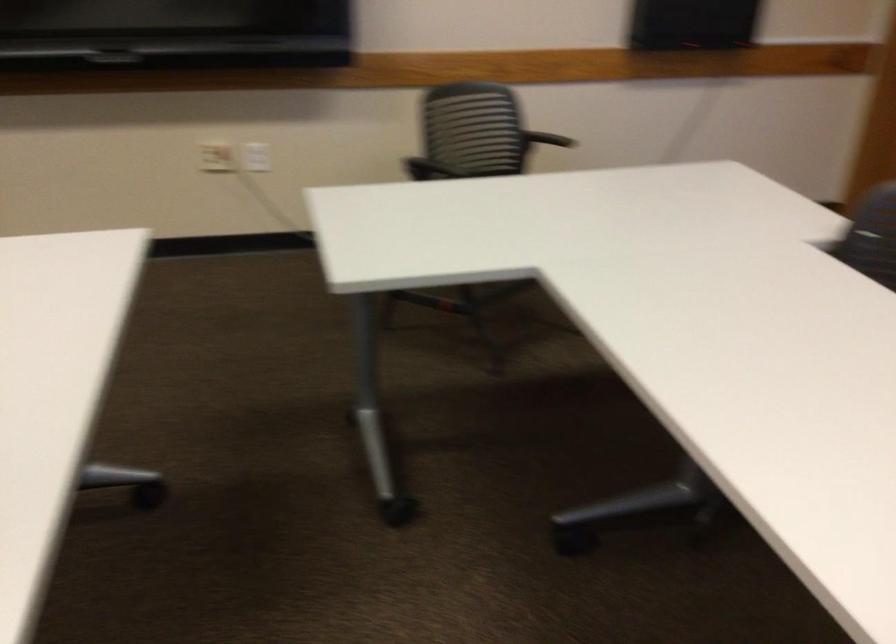
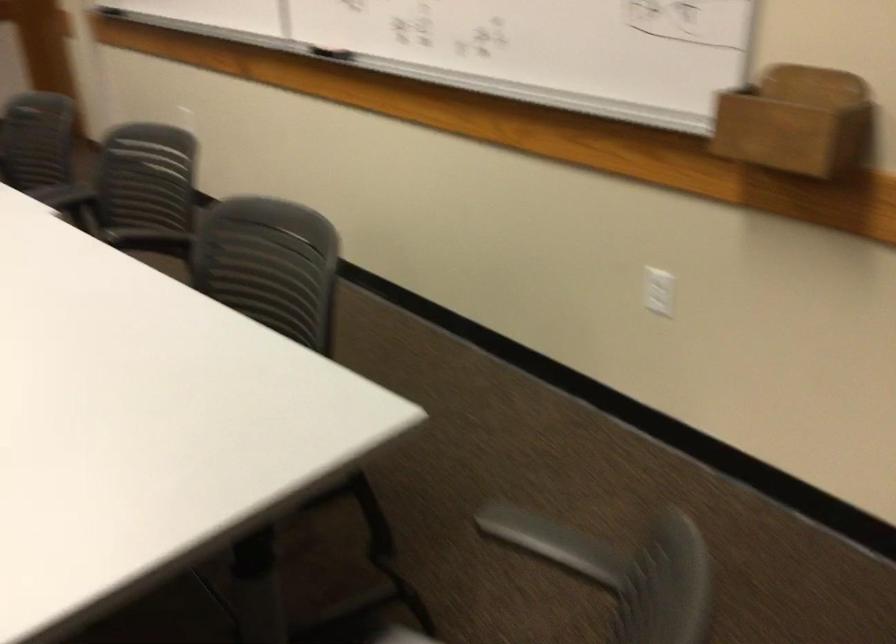
In a continuous first-person perspective shot, in which direction is the camera moving?

The cameraman walked toward right, backward.